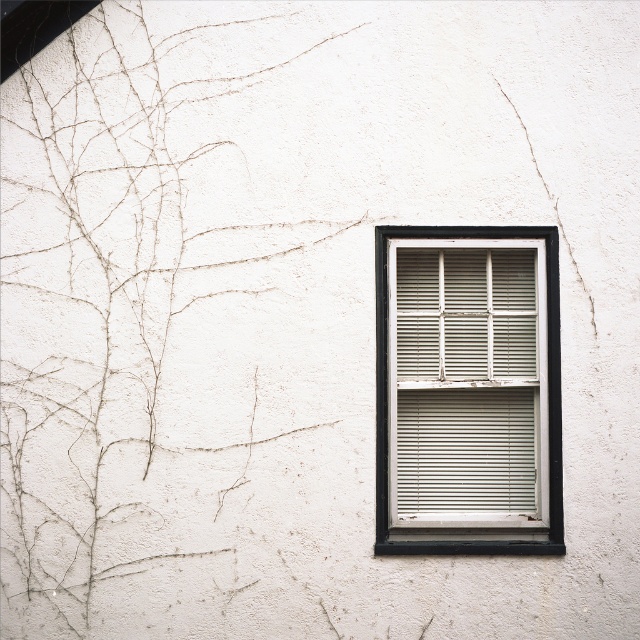
Is brown textured ivy at upper left taller than white painted wood window frame at center?

Correct, brown textured ivy at upper left is much taller as white painted wood window frame at center.

Between brown textured ivy at upper left and white painted wood window frame at center, which one appears on the right side from the viewer's perspective?

white painted wood window frame at center

Is point (77, 339) closer to camera compared to point (540, 392)?

Yes, point (77, 339) is closer to viewer.

You are a GUI agent. You are given a task and a screenshot of the screen. Output one action in this format:
    pyautogui.click(x=<x>, y=<y>)
    Task: Click on the brown textured ivy at upper left
    
    Given the screenshot: What is the action you would take?
    pyautogui.click(x=140, y=312)